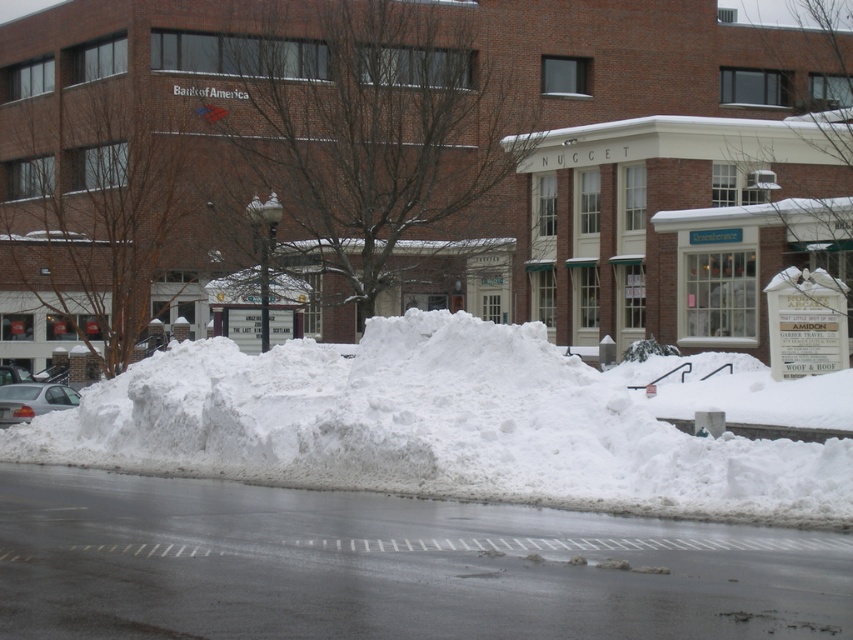
You are a delivery person trying to navigate through the snowy area. You see the white fluffy snow at center and the silver metallic sedan at lower left. Which object is nearer to you as you approach the scene?

The white fluffy snow at center is closer to the viewer than the silver metallic sedan at lower left, so the white fluffy snow at center is nearer.

You are a delivery person who needs to park your 5.5 meter long truck between the white fluffy snow at center and the silver metallic sedan at lower left. Is there enough space for your truck to fit without overlapping either object?

The distance between the white fluffy snow at center and the silver metallic sedan at lower left is 8.26 meters. Since your truck is 5.5 meters long, there is sufficient space for it to fit between them without overlapping either object.